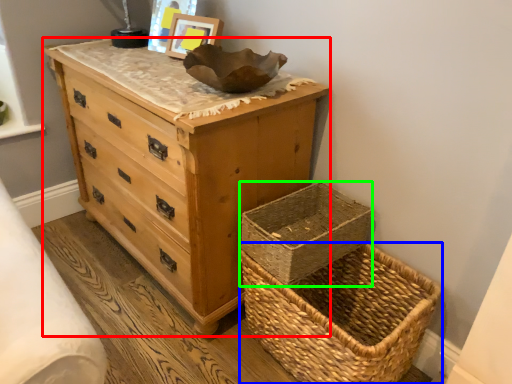
Question: Which is nearer to the chest of drawers (highlighted by a red box)? picnic basket (highlighted by a blue box) or basket container (highlighted by a green box).

Choices:
 (A) picnic basket
 (B) basket container

Answer: (B)